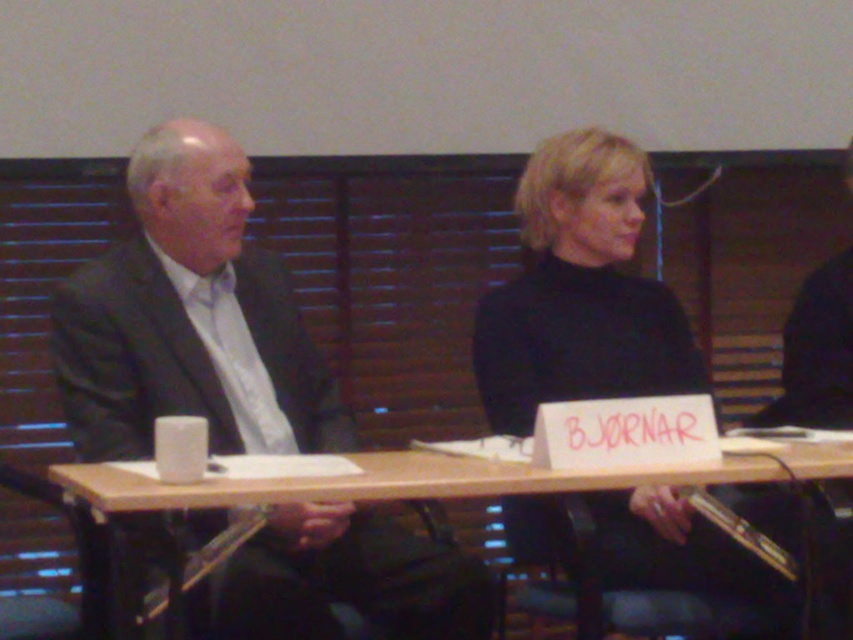
Question: Is the position of dark gray suit at left more distant than that of wooden table at center?

Choices:
 (A) no
 (B) yes

Answer: (B)

Question: Does dark gray suit at left come behind black matte turtleneck at center?

Choices:
 (A) no
 (B) yes

Answer: (A)

Question: Among these points, which one is nearest to the camera?

Choices:
 (A) (608, 156)
 (B) (173, 490)

Answer: (B)

Question: Does dark gray suit at left appear on the left side of wooden table at center?

Choices:
 (A) yes
 (B) no

Answer: (A)

Question: Which point is farther to the camera?

Choices:
 (A) dark gray suit at left
 (B) wooden table at center

Answer: (A)

Question: Which object is farther from the camera taking this photo?

Choices:
 (A) wooden table at center
 (B) black matte turtleneck at center
 (C) dark gray suit at left

Answer: (B)